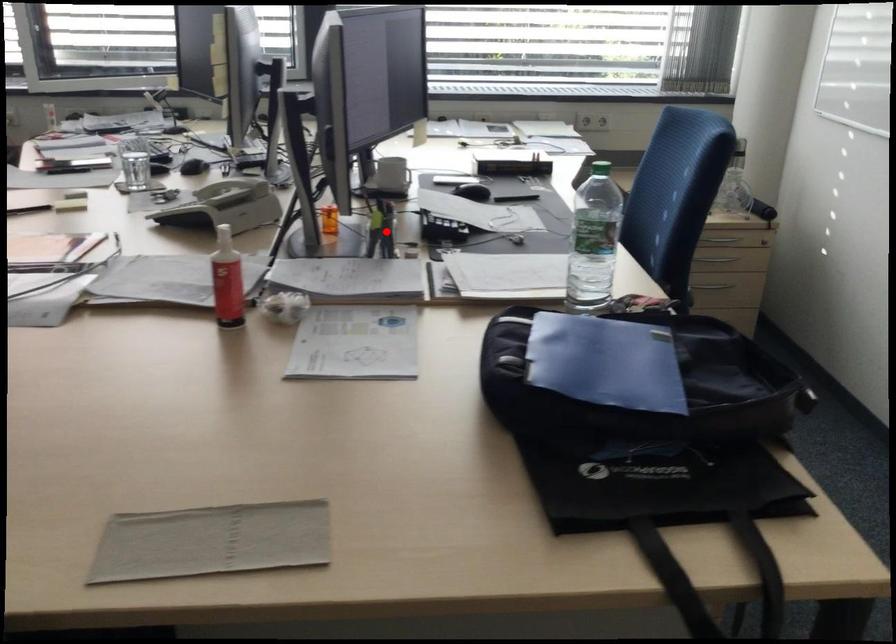
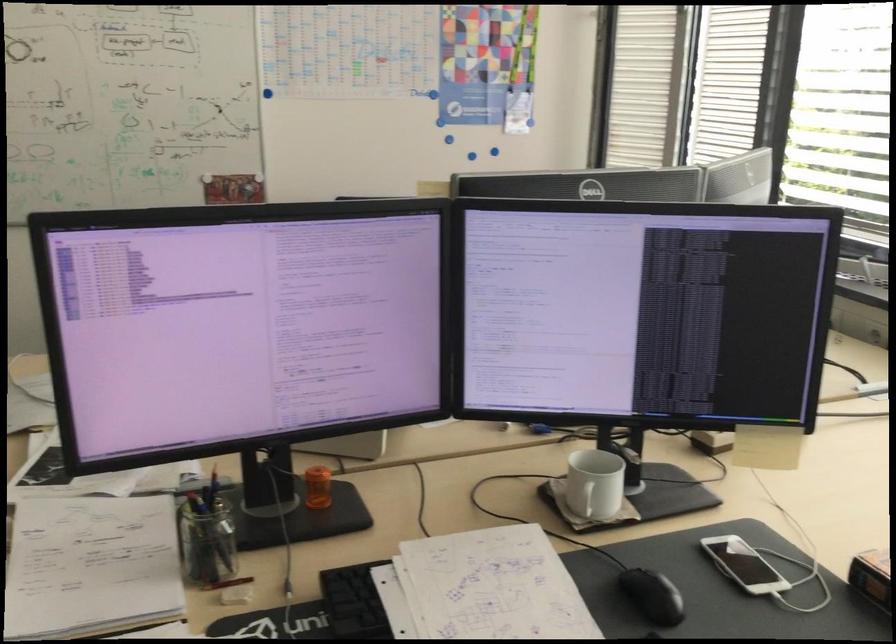
Locate, in the second image, the point that corresponds to the highlighted location in the first image.

(205, 538)